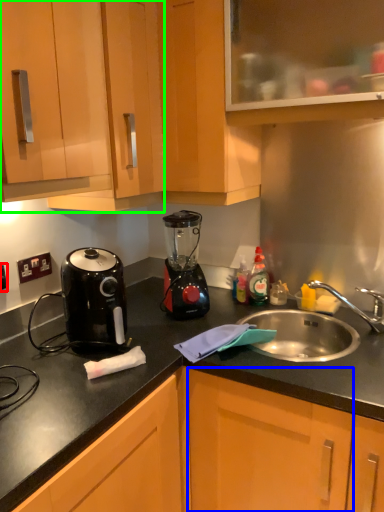
Question: Considering the real-world distances, which object is farthest from electric outlet (highlighted by a red box)? cabinetry (highlighted by a blue box) or cabinetry (highlighted by a green box)?

Choices:
 (A) cabinetry
 (B) cabinetry

Answer: (A)